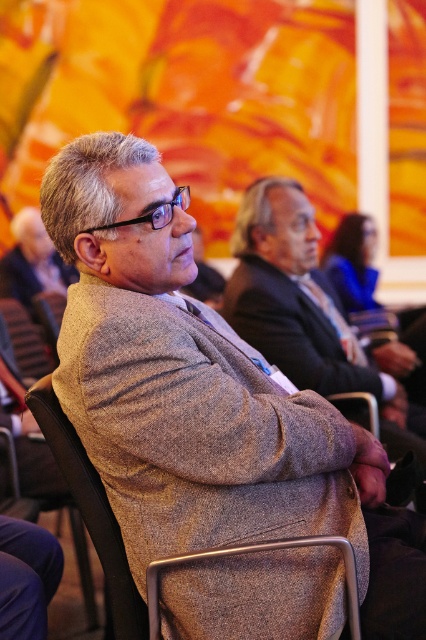
Question: Does gray woolen suit at center appear on the right side of matte gray coat at center?

Choices:
 (A) yes
 (B) no

Answer: (A)

Question: Which point is farther from the camera taking this photo?

Choices:
 (A) (43, 396)
 (B) (108, 298)
 (C) (63, 266)
 (D) (299, 358)

Answer: (C)

Question: Can you confirm if textured gray blazer at center is smaller than matte gray coat at center?

Choices:
 (A) yes
 (B) no

Answer: (B)

Question: Considering the real-world distances, which object is farthest from the matte gray coat at center?

Choices:
 (A) textured gray blazer at center
 (B) textured wool coat at center

Answer: (B)

Question: Is textured gray blazer at center to the left of matte gray coat at center from the viewer's perspective?

Choices:
 (A) yes
 (B) no

Answer: (B)

Question: Which of the following is the farthest from the observer?

Choices:
 (A) (236, 230)
 (B) (238, 524)
 (C) (106, 518)

Answer: (A)